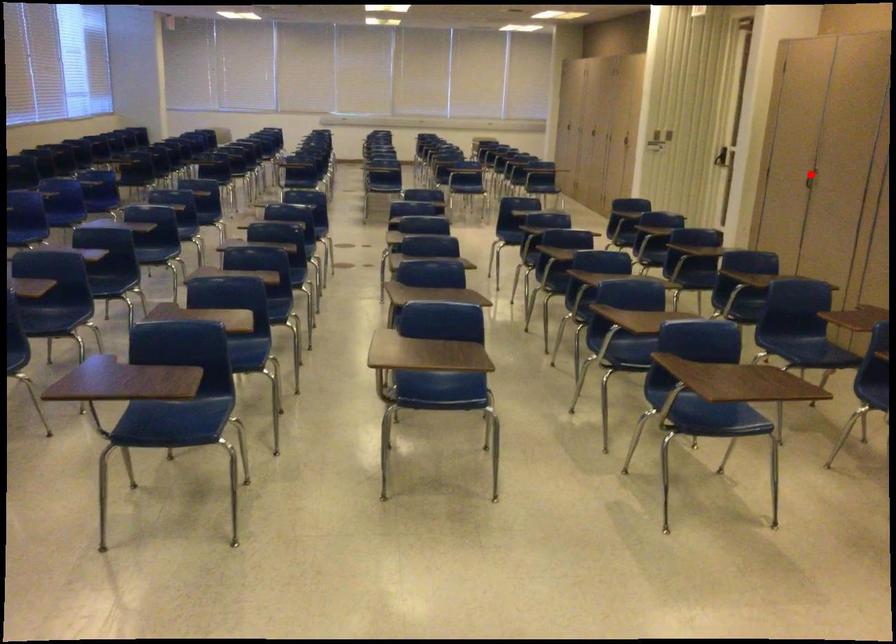
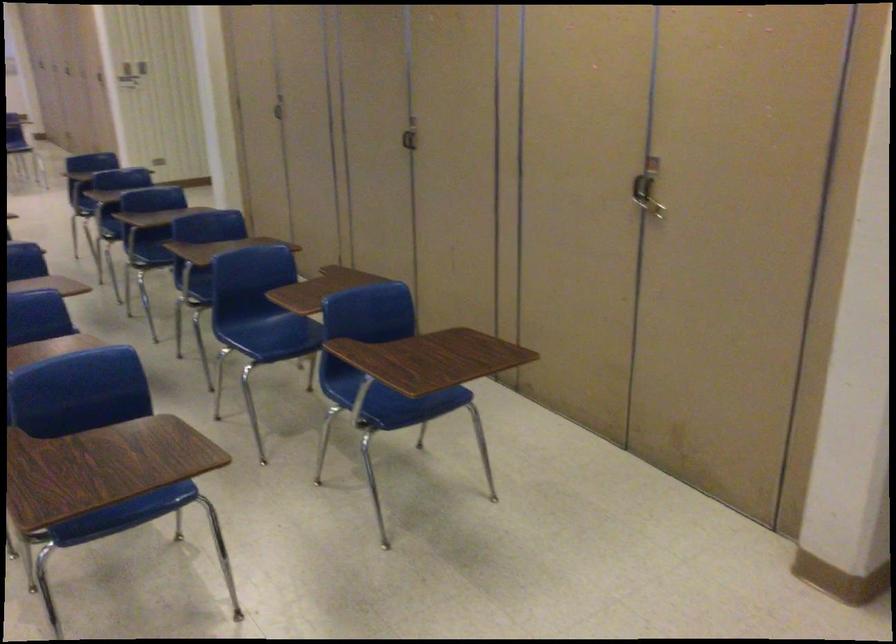
Find the pixel in the second image that matches the highlighted location in the first image.

(279, 107)